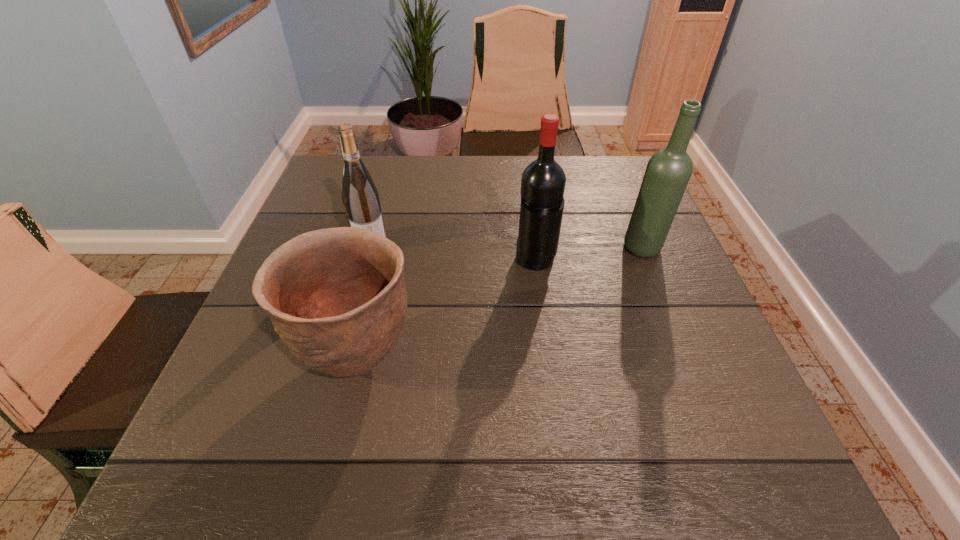
Where is `the rightmost object`? This screenshot has height=540, width=960. the rightmost object is located at coordinates (668, 171).

In order to click on the second object from right to left in this screenshot , I will do [x=543, y=181].

Image resolution: width=960 pixels, height=540 pixels. I want to click on the shortest wine bottle, so click(360, 196).

You are a GUI agent. You are given a task and a screenshot of the screen. Output one action in this format:
    pyautogui.click(x=<x>, y=<y>)
    Task: Click on the second shortest object
    Image resolution: width=960 pixels, height=540 pixels.
    Given the screenshot: What is the action you would take?
    pyautogui.click(x=360, y=196)

Find the location of a particular element. the nearest object is located at coordinates (337, 298).

The image size is (960, 540). What are the coordinates of `the shortest object` in the screenshot? It's located at (337, 298).

You are a GUI agent. You are given a task and a screenshot of the screen. Output one action in this format:
    pyautogui.click(x=<x>, y=<y>)
    Task: Click on the free space located 0.160m on the back of the rightmost object
    The image size is (960, 540).
    Given the screenshot: What is the action you would take?
    pyautogui.click(x=622, y=198)

At what (x,y) coordinates should I click in order to perform the action: click on vacant space located on the back of the second object from right to left. Please return your answer as a coordinate pair (x, y). Looking at the image, I should click on (526, 198).

Identify the location of free space located 0.260m on the back of the second shortest object. Image resolution: width=960 pixels, height=540 pixels. (390, 176).

Where is `vacant area located on the back of the shortest object`? The height and width of the screenshot is (540, 960). vacant area located on the back of the shortest object is located at coordinates (396, 199).